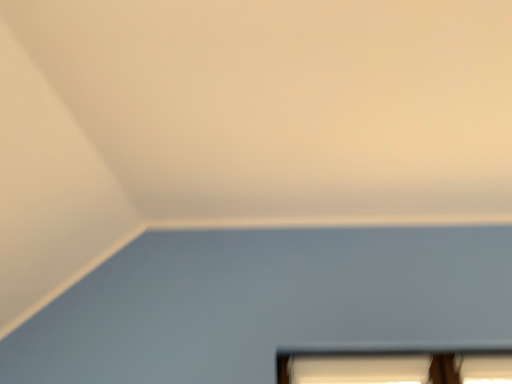
What do you see at coordinates (395, 368) in the screenshot?
I see `white glossy window at lower center` at bounding box center [395, 368].

The width and height of the screenshot is (512, 384). In order to click on white glossy window at lower center in this screenshot , I will do `click(395, 368)`.

Where is `white glossy window at lower center`? Image resolution: width=512 pixels, height=384 pixels. white glossy window at lower center is located at coordinates (395, 368).